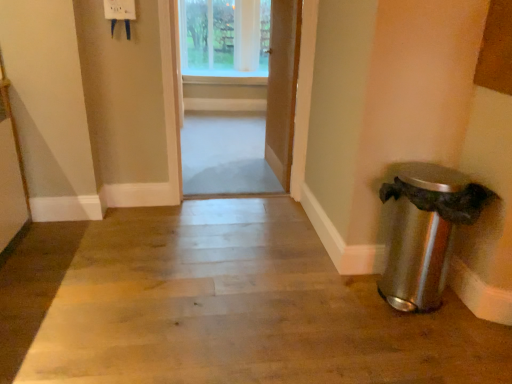
Question: In which direction should I rotate to look at wooden door at center, which is the first door from right to left?

Choices:
 (A) left
 (B) right

Answer: (B)

Question: Can you confirm if clear glass window at upper center is positioned to the right of wooden door at center, the first door when ordered from left to right?

Choices:
 (A) no
 (B) yes

Answer: (A)

Question: Considering the relative sizes of clear glass window at upper center and wooden door at center, which ranks as the 2th door in right-to-left order, in the image provided, is clear glass window at upper center taller than wooden door at center, which ranks as the 2th door in right-to-left order,?

Choices:
 (A) no
 (B) yes

Answer: (A)

Question: Can you confirm if clear glass window at upper center is positioned to the left of wooden door at center, the first door when ordered from left to right?

Choices:
 (A) no
 (B) yes

Answer: (B)

Question: Is clear glass window at upper center far from wooden door at center, which ranks as the 2th door in right-to-left order?

Choices:
 (A) no
 (B) yes

Answer: (A)

Question: Is clear glass window at upper center behind wooden door at center, the first door when ordered from left to right?

Choices:
 (A) no
 (B) yes

Answer: (B)

Question: Is clear glass window at upper center facing away from wooden door at center, the first door when ordered from left to right?

Choices:
 (A) yes
 (B) no

Answer: (B)

Question: From the image's perspective, is satin silver trash can at lower right located above wooden door at center, the 2th door viewed from the left?

Choices:
 (A) yes
 (B) no

Answer: (B)

Question: Are satin silver trash can at lower right and wooden door at center, the 2th door viewed from the left, making contact?

Choices:
 (A) yes
 (B) no

Answer: (B)

Question: From a real-world perspective, is satin silver trash can at lower right on wooden door at center, the 2th door viewed from the left?

Choices:
 (A) no
 (B) yes

Answer: (A)

Question: Is satin silver trash can at lower right to the left of wooden door at center, the 2th door viewed from the left, from the viewer's perspective?

Choices:
 (A) no
 (B) yes

Answer: (A)

Question: Is satin silver trash can at lower right closer to the viewer compared to wooden door at center, the 2th door viewed from the left?

Choices:
 (A) yes
 (B) no

Answer: (A)

Question: Is satin silver trash can at lower right smaller than wooden door at center, which is the first door from right to left?

Choices:
 (A) yes
 (B) no

Answer: (B)

Question: Is wooden door at center, the first door when ordered from left to right, outside clear glass window at upper center?

Choices:
 (A) yes
 (B) no

Answer: (A)